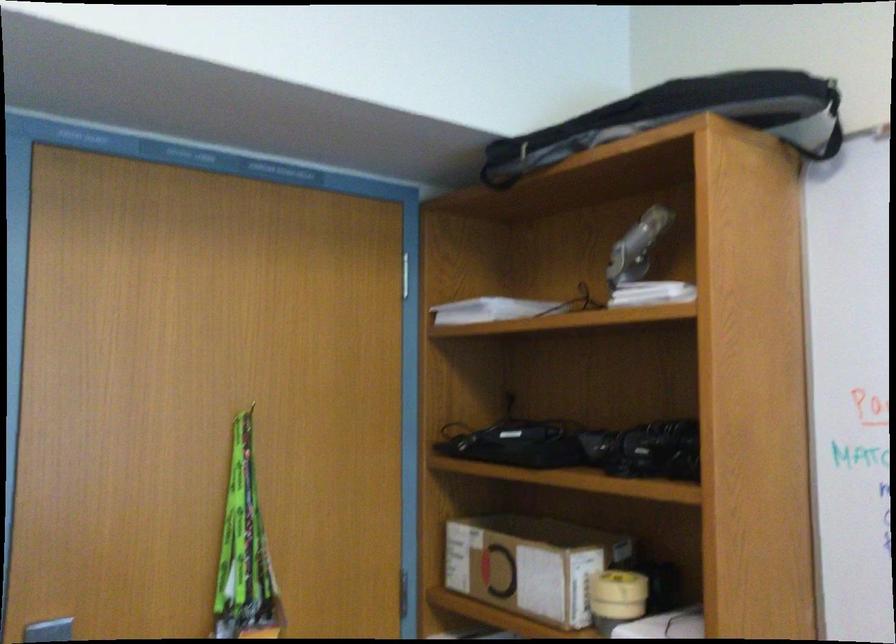
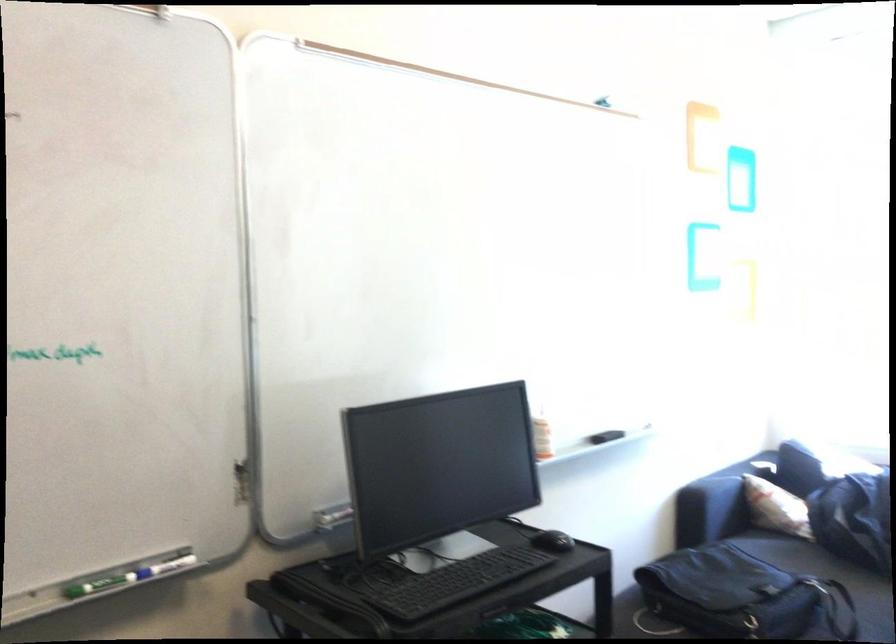
Question: Based on the continuous images, in which direction is the camera rotating? Reply with the corresponding letter.

Choices:
 (A) Left
 (B) Right
 (C) Up
 (D) Down

Answer: (B)